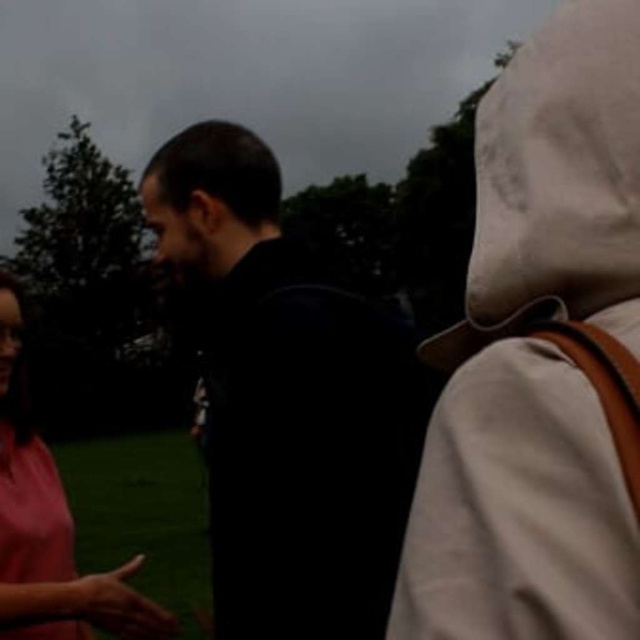
Based on the scene description, if you were standing where the photographer was, which object would be closer to your right side, the black matte jacket at center or the pink matte shirt at left?

The black matte jacket at center is to the right of the pink matte shirt at left, so the black matte jacket at center would be closer to your right side.

You are standing at the point marked by the coordinates point (289, 403) in the image. Looking around, you see a person in a red top on the left and another person in dark clothing facing away at center. Which direction should you turn to face the person in the red top?

The point (289, 403) is on the black matte jacket at center. To face the person in the red top on the left, you should turn to your left.

You are a photographer trying to adjust the focus of your camera. You want to ensure that both the black matte jacket at center and the pink matte shirt at left are clearly visible in the final photo. Based on their positions, which object should you focus on first to ensure both are in focus?

The black matte jacket at center is positioned over the pink matte shirt at left, so focusing on the black matte jacket at center would ensure both are in focus since it is closer to the camera.